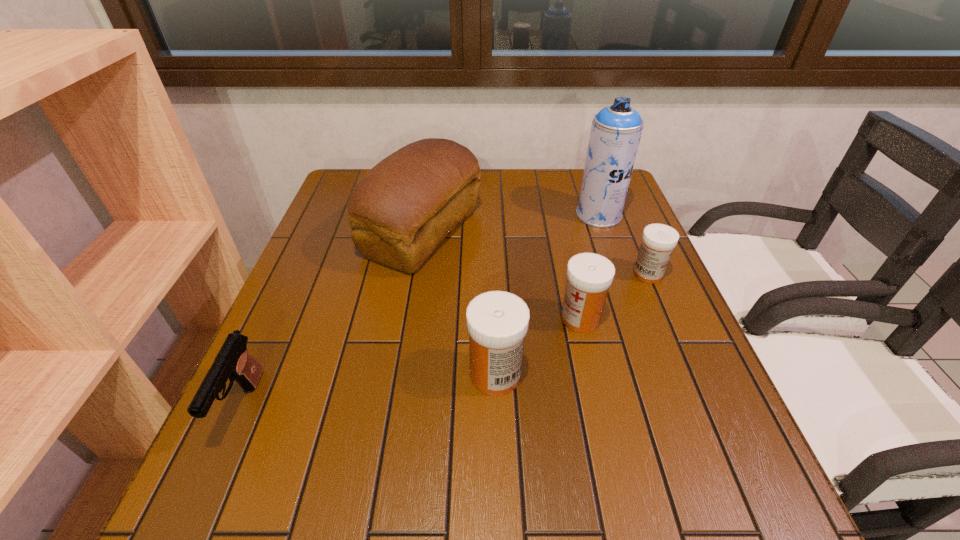
Where is `the nearest medicine`? The image size is (960, 540). the nearest medicine is located at coordinates (497, 322).

Where is `the third nearest object`? The width and height of the screenshot is (960, 540). the third nearest object is located at coordinates (589, 276).

What are the coordinates of `the second tallest medicine` in the screenshot? It's located at (589, 276).

This screenshot has height=540, width=960. In order to click on the farthest medicine in this screenshot , I will do `click(658, 240)`.

At what (x,y) coordinates should I click in order to perform the action: click on the shortest medicine. Please return your answer as a coordinate pair (x, y). Looking at the image, I should click on (658, 240).

The image size is (960, 540). I want to click on the tallest object, so click(616, 130).

Locate an element on the screen. This screenshot has width=960, height=540. the fifth shortest object is located at coordinates (400, 210).

Identify the location of the leftmost object. (233, 361).

Find the location of a particular element. Image resolution: width=960 pixels, height=540 pixels. vacant area located 0.260m on the left of the leftmost medicine is located at coordinates (336, 374).

At what (x,y) coordinates should I click in order to perform the action: click on vacant area located on the left of the fourth object from left to right. Please return your answer as a coordinate pair (x, y). Looking at the image, I should click on (456, 319).